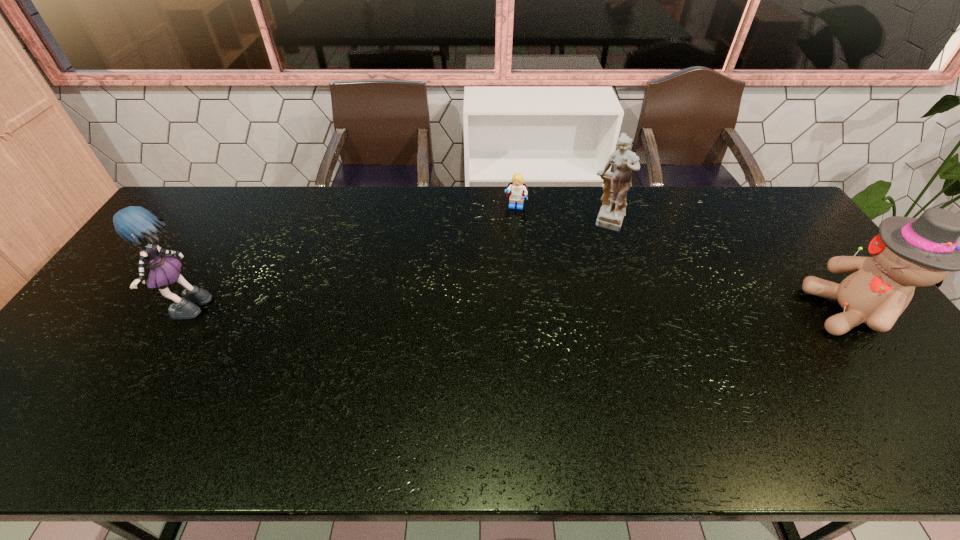
The width and height of the screenshot is (960, 540). I want to click on the left rag_doll, so click(x=136, y=225).

Locate an element on the screen. The image size is (960, 540). the right rag_doll is located at coordinates (908, 252).

Image resolution: width=960 pixels, height=540 pixels. I want to click on the shortest object, so click(517, 190).

At what (x,y) coordinates should I click in order to perform the action: click on Lego. Please return your answer as a coordinate pair (x, y). Looking at the image, I should click on (517, 190).

You are a GUI agent. You are given a task and a screenshot of the screen. Output one action in this format:
    pyautogui.click(x=<x>, y=<y>)
    Task: Click on the second object from right to left
    
    Given the screenshot: What is the action you would take?
    pyautogui.click(x=616, y=185)

You are a GUI agent. You are given a task and a screenshot of the screen. Output one action in this format:
    pyautogui.click(x=<x>, y=<y>)
    Task: Click on the vacant space situated on the front-facing side of the left rag_doll
    The height and width of the screenshot is (540, 960).
    Given the screenshot: What is the action you would take?
    pyautogui.click(x=137, y=312)

Where is `vacant area situated on the front-facing side of the left rag_doll`? The height and width of the screenshot is (540, 960). vacant area situated on the front-facing side of the left rag_doll is located at coordinates (101, 312).

This screenshot has height=540, width=960. Find the location of `free space located on the front-facing side of the left rag_doll`. free space located on the front-facing side of the left rag_doll is located at coordinates (141, 312).

The height and width of the screenshot is (540, 960). Identify the location of vacant area situated on the front-facing side of the rightmost object. (718, 312).

The image size is (960, 540). I want to click on free space located on the front-facing side of the rightmost object, so click(x=791, y=312).